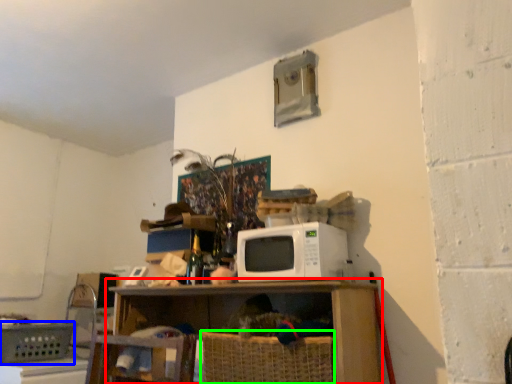
Question: Which is nearer to the shelf (highlighted by a red box)? basket (highlighted by a blue box) or basket (highlighted by a green box).

Choices:
 (A) basket
 (B) basket

Answer: (B)